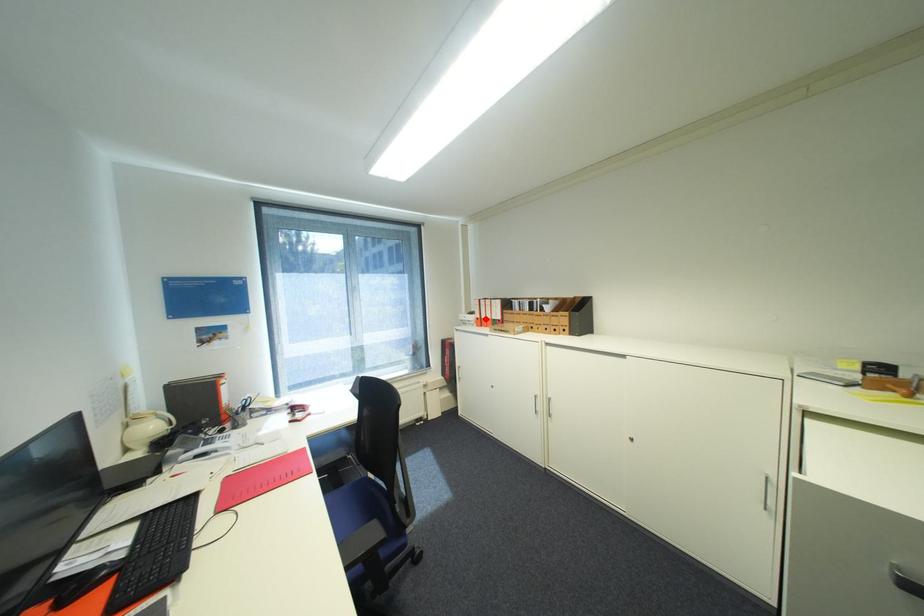
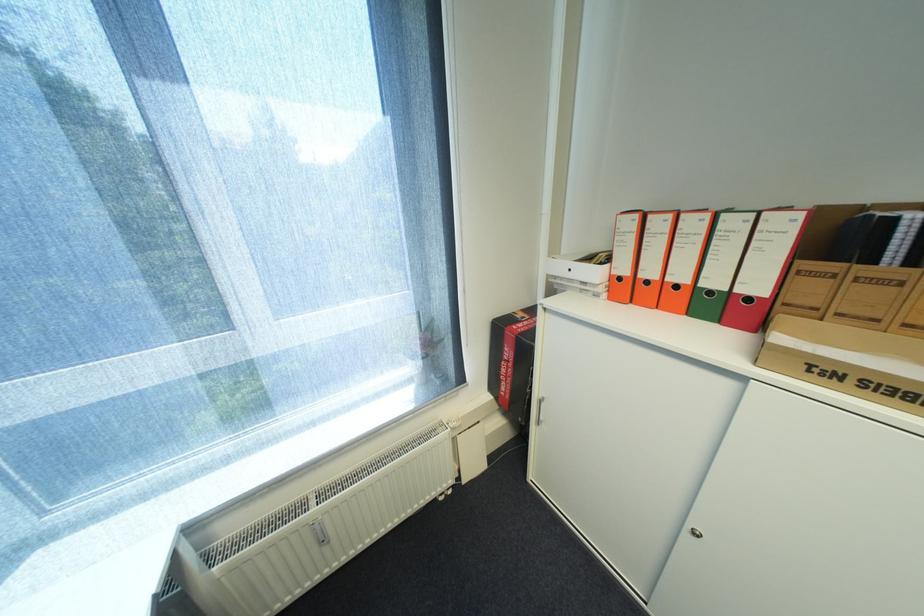
Find the pixel in the second image that matches the highlighted location in the first image.

(627, 278)